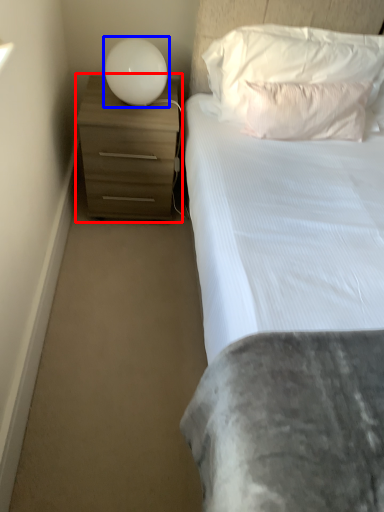
Question: Among these objects, which one is nearest to the camera, chest of drawers (highlighted by a red box) or lamp (highlighted by a blue box)?

Choices:
 (A) chest of drawers
 (B) lamp

Answer: (B)